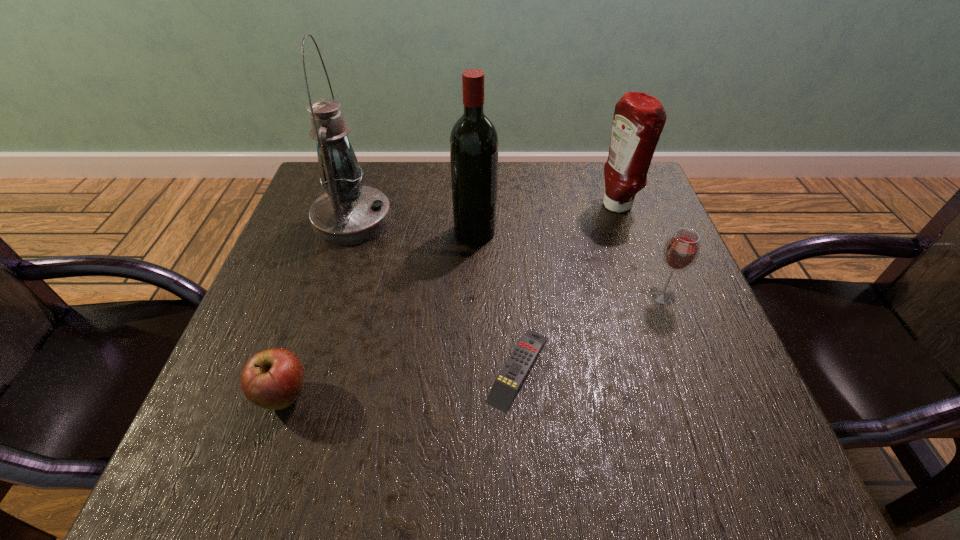
Locate an element on the screen. vacant point located between the shortest object and the oil lamp is located at coordinates (436, 294).

Find the location of `free space between the oil lamp and the apple`. free space between the oil lamp and the apple is located at coordinates (319, 308).

In order to click on vacant area between the oil lamp and the second shortest object in this screenshot , I will do `click(319, 308)`.

This screenshot has width=960, height=540. In order to click on free space that is in between the fourth farthest object and the wine bottle in this screenshot , I will do pyautogui.click(x=568, y=264).

In order to click on blank region between the oil lamp and the wine bottle in this screenshot , I will do [x=414, y=226].

The height and width of the screenshot is (540, 960). What are the coordinates of `object that is the fifth nearest to the second shortest object` in the screenshot? It's located at (639, 118).

At what (x,y) coordinates should I click in order to perform the action: click on object that is the fifth closest to the remote control. Please return your answer as a coordinate pair (x, y). Looking at the image, I should click on (639, 118).

Where is `vacant space that satisfies the following two spatial constraints: 1. on the front side of the oil lamp; 2. on the left side of the fourth farthest object`? vacant space that satisfies the following two spatial constraints: 1. on the front side of the oil lamp; 2. on the left side of the fourth farthest object is located at coordinates (328, 295).

The width and height of the screenshot is (960, 540). Find the location of `vacant space that satisfies the following two spatial constraints: 1. on the back side of the fourth tallest object; 2. on the left side of the apple`. vacant space that satisfies the following two spatial constraints: 1. on the back side of the fourth tallest object; 2. on the left side of the apple is located at coordinates (319, 295).

This screenshot has height=540, width=960. Find the location of `vacant area that satisfies the following two spatial constraints: 1. on the front side of the condiment; 2. on the label of the wine bottle`. vacant area that satisfies the following two spatial constraints: 1. on the front side of the condiment; 2. on the label of the wine bottle is located at coordinates (625, 232).